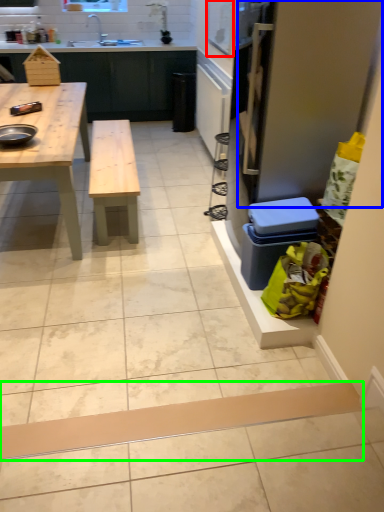
Question: Which object is positioned farthest from window screen (highlighted by a red box)? Select from screen door (highlighted by a blue box) and plank (highlighted by a green box).

Choices:
 (A) screen door
 (B) plank

Answer: (B)